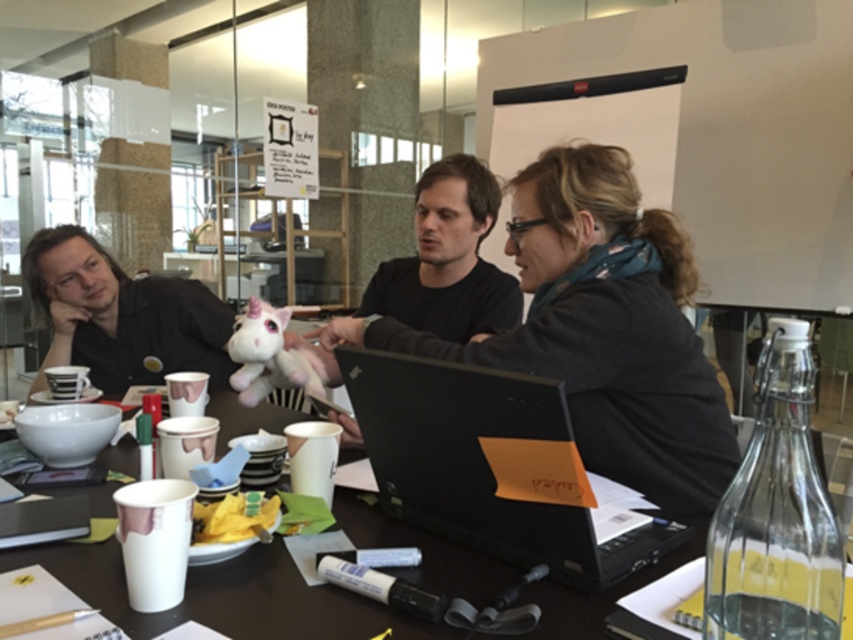
You are standing in front of the table where the meeting is happening. There are two points marked on the table surface at coordinates point [283,577] and point [474,285]. Which of these points is closer to you?

Point [283,577] is closer to the camera than point [474,285], so the point closer to you is point [283,577].